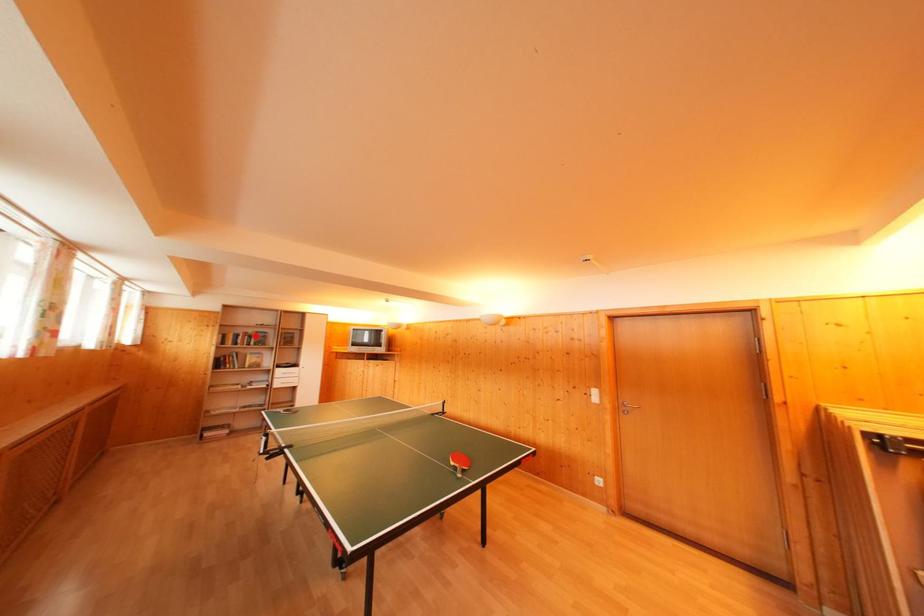
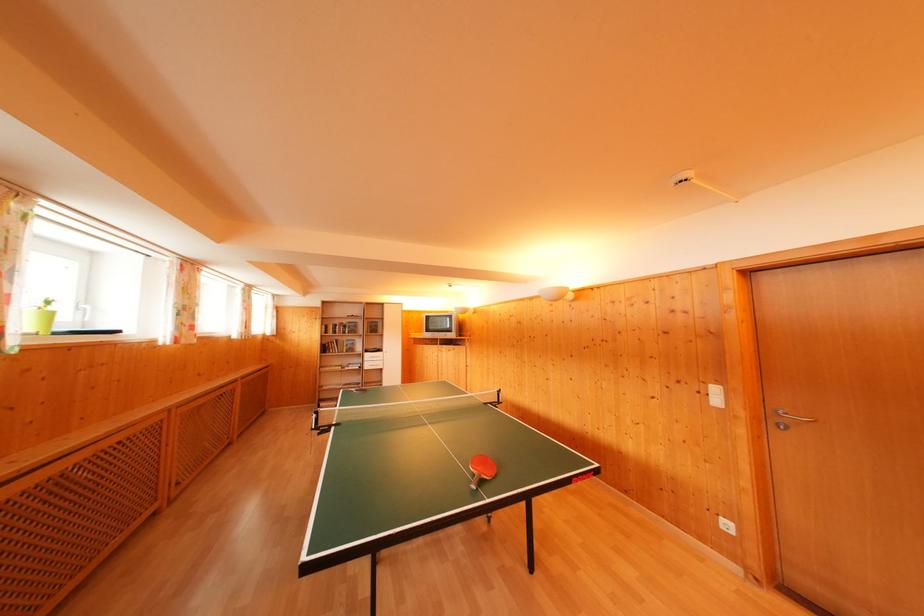
Find the pixel in the second image that matches the highlighted location in the first image.

(349, 326)